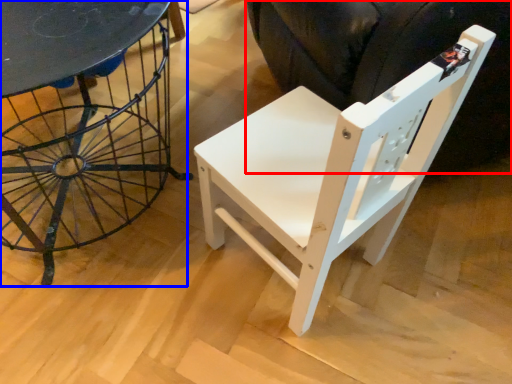
Question: Which object appears farthest to the camera in this image, swivel chair (highlighted by a red box) or table (highlighted by a blue box)?

Choices:
 (A) swivel chair
 (B) table

Answer: (A)